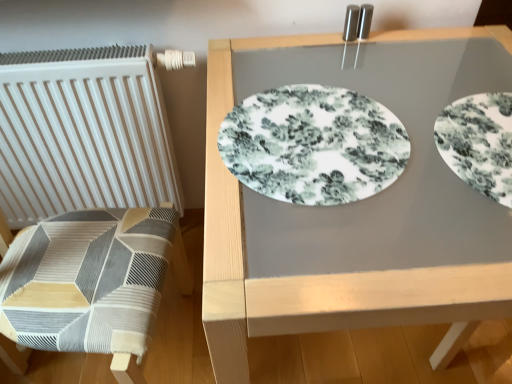
This screenshot has height=384, width=512. What do you see at coordinates (313, 145) in the screenshot?
I see `white floral plate at center, the 2th plate in the right-to-left sequence` at bounding box center [313, 145].

What do you see at coordinates (316, 251) in the screenshot? I see `white glossy placemat at center` at bounding box center [316, 251].

Find the location of a particular element. This screenshot has width=512, height=384. white floral plate at upper right, marked as the second plate in a left-to-right arrangement is located at coordinates 479,142.

This screenshot has width=512, height=384. Identify the location of white matte radiator at left. (83, 133).

What is the approximate height of white matte radiator at left?

white matte radiator at left is 22.07 inches tall.

Locate an element on the screen. This screenshot has width=512, height=384. white floral plate at center, the 1th plate in the left-to-right sequence is located at coordinates (313, 145).

Locate an element on the screen. The height and width of the screenshot is (384, 512). the 1st plate behind the white glossy placemat at center is located at coordinates (479, 142).

From a real-world perspective, which is physically below, white floral plate at upper right, marked as the second plate in a left-to-right arrangement, or white glossy placemat at center?

white glossy placemat at center is physically lower.

Does white floral plate at upper right, marked as the second plate in a left-to-right arrangement, have a smaller size compared to white glossy placemat at center?

Correct, white floral plate at upper right, marked as the second plate in a left-to-right arrangement, occupies less space than white glossy placemat at center.

Is white floral plate at upper right, placed as the first plate when sorted from right to left, beside white glossy placemat at center?

No, white floral plate at upper right, placed as the first plate when sorted from right to left, is not with white glossy placemat at center.

Considering the relative positions of white glossy placemat at center and white floral plate at center, the 2th plate in the right-to-left sequence, in the image provided, is white glossy placemat at center to the left of white floral plate at center, the 2th plate in the right-to-left sequence, from the viewer's perspective?

In fact, white glossy placemat at center is to the right of white floral plate at center, the 2th plate in the right-to-left sequence.

Considering the points (480, 80) and (268, 180), which point is behind, point (480, 80) or point (268, 180)?

The point (480, 80) is farther from the camera.

The image size is (512, 384). In order to click on the 2nd plate above the white glossy placemat at center (from the image's perspective) in this screenshot , I will do `click(313, 145)`.

Starting from the white matte radiator at left, which plate is the 2nd one in front? Please provide its 2D coordinates.

[(479, 142)]

Is white floral plate at upper right, placed as the first plate when sorted from right to left, further to camera compared to white matte radiator at left?

No, white floral plate at upper right, placed as the first plate when sorted from right to left, is closer to the viewer.

Is white floral plate at upper right, marked as the second plate in a left-to-right arrangement, looking in the opposite direction of white matte radiator at left?

No, white floral plate at upper right, marked as the second plate in a left-to-right arrangement, is not facing the opposite direction of white matte radiator at left.

From a real-world perspective, is white floral plate at upper right, marked as the second plate in a left-to-right arrangement, positioned above or below white matte radiator at left?

In terms of real-world spatial position, white floral plate at upper right, marked as the second plate in a left-to-right arrangement, is above white matte radiator at left.

From the image's perspective, is white floral plate at center, the 2th plate in the right-to-left sequence, located beneath white matte radiator at left?

Yes.

Is white floral plate at center, the 2th plate in the right-to-left sequence, looking in the opposite direction of white matte radiator at left?

No, white floral plate at center, the 2th plate in the right-to-left sequence, is not facing away from white matte radiator at left.

In terms of height, does white floral plate at center, the 1th plate in the left-to-right sequence, look taller or shorter compared to white matte radiator at left?

white floral plate at center, the 1th plate in the left-to-right sequence, is shorter than white matte radiator at left.

From a real-world perspective, is white glossy placemat at center physically below white matte radiator at left?

Yes.

Which is closer to the camera, (402, 207) or (129, 140)?

The point (402, 207) is closer to the camera.

Is white glossy placemat at center with white matte radiator at left?

white glossy placemat at center and white matte radiator at left are clearly separated.

From the image's perspective, is white matte radiator at left under white floral plate at upper right, placed as the first plate when sorted from right to left?

No.

Which object is wider, white matte radiator at left or white floral plate at upper right, marked as the second plate in a left-to-right arrangement?

white floral plate at upper right, marked as the second plate in a left-to-right arrangement, is wider.

Measure the distance from white matte radiator at left to white floral plate at upper right, marked as the second plate in a left-to-right arrangement.

The distance of white matte radiator at left from white floral plate at upper right, marked as the second plate in a left-to-right arrangement, is 36.12 inches.

Are white matte radiator at left and white floral plate at upper right, marked as the second plate in a left-to-right arrangement, beside each other?

No, white matte radiator at left is not in contact with white floral plate at upper right, marked as the second plate in a left-to-right arrangement.

Which is correct: white floral plate at center, the 2th plate in the right-to-left sequence, is inside white floral plate at upper right, placed as the first plate when sorted from right to left, or outside of it?

white floral plate at center, the 2th plate in the right-to-left sequence, is spatially situated outside white floral plate at upper right, placed as the first plate when sorted from right to left.

Considering the sizes of objects white floral plate at center, the 1th plate in the left-to-right sequence, and white floral plate at upper right, placed as the first plate when sorted from right to left, in the image provided, who is bigger, white floral plate at center, the 1th plate in the left-to-right sequence, or white floral plate at upper right, placed as the first plate when sorted from right to left,?

white floral plate at center, the 1th plate in the left-to-right sequence, is bigger.

Is white floral plate at center, the 1th plate in the left-to-right sequence, facing towards white floral plate at upper right, placed as the first plate when sorted from right to left?

No, white floral plate at center, the 1th plate in the left-to-right sequence, does not turn towards white floral plate at upper right, placed as the first plate when sorted from right to left.

From a real-world perspective, is white floral plate at center, the 2th plate in the right-to-left sequence, located higher than white floral plate at upper right, marked as the second plate in a left-to-right arrangement?

No, from a real-world perspective, white floral plate at center, the 2th plate in the right-to-left sequence, is not over white floral plate at upper right, marked as the second plate in a left-to-right arrangement

The image size is (512, 384). What are the coordinates of `table that is under the white floral plate at upper right, marked as the second plate in a left-to-right arrangement (from a real-world perspective)` in the screenshot? It's located at (316, 251).

From the white glossy placemat at center, count 2nd plates backward and point to it. Please provide its 2D coordinates.

[(313, 145)]

From the image, which object appears to be nearer to white floral plate at upper right, placed as the first plate when sorted from right to left, white glossy placemat at center or white floral plate at center, the 1th plate in the left-to-right sequence?

Among the two, white floral plate at center, the 1th plate in the left-to-right sequence, is located nearer to white floral plate at upper right, placed as the first plate when sorted from right to left.

Which object lies further to the anchor point white floral plate at upper right, placed as the first plate when sorted from right to left, white floral plate at center, the 1th plate in the left-to-right sequence, or white matte radiator at left?

white matte radiator at left.

Considering their positions, is white glossy placemat at center positioned closer to white floral plate at center, the 2th plate in the right-to-left sequence, than white matte radiator at left?

white glossy placemat at center lies closer to white floral plate at center, the 2th plate in the right-to-left sequence, than the other object.

From the image, which object appears to be nearer to white glossy placemat at center, white floral plate at center, the 2th plate in the right-to-left sequence, or white floral plate at upper right, placed as the first plate when sorted from right to left?

white floral plate at center, the 2th plate in the right-to-left sequence.

Considering their positions, is white floral plate at upper right, placed as the first plate when sorted from right to left, positioned closer to white glossy placemat at center than white matte radiator at left?

The object closer to white glossy placemat at center is white floral plate at upper right, placed as the first plate when sorted from right to left.

When comparing their distances from white matte radiator at left, does white glossy placemat at center or white floral plate at center, the 1th plate in the left-to-right sequence, seem further?

The object further to white matte radiator at left is white floral plate at center, the 1th plate in the left-to-right sequence.

Based on their spatial positions, is white floral plate at upper right, placed as the first plate when sorted from right to left, or white matte radiator at left further from white floral plate at center, the 1th plate in the left-to-right sequence?

white matte radiator at left is further to white floral plate at center, the 1th plate in the left-to-right sequence.

Estimate the real-world distances between objects in this image. Which object is further from white floral plate at upper right, placed as the first plate when sorted from right to left, white matte radiator at left or white floral plate at center, the 2th plate in the right-to-left sequence?

Among the two, white matte radiator at left is located further to white floral plate at upper right, placed as the first plate when sorted from right to left.

This screenshot has height=384, width=512. In order to click on plate between white matte radiator at left and white glossy placemat at center in this screenshot , I will do `click(313, 145)`.

Image resolution: width=512 pixels, height=384 pixels. I want to click on table located between white matte radiator at left and white floral plate at upper right, marked as the second plate in a left-to-right arrangement, in the left-right direction, so click(x=316, y=251).

The height and width of the screenshot is (384, 512). Identify the location of plate located between white matte radiator at left and white floral plate at upper right, marked as the second plate in a left-to-right arrangement, in the left-right direction. (313, 145).

This screenshot has height=384, width=512. Find the location of `table located between white floral plate at center, the 1th plate in the left-to-right sequence, and white floral plate at upper right, marked as the second plate in a left-to-right arrangement, in the left-right direction`. table located between white floral plate at center, the 1th plate in the left-to-right sequence, and white floral plate at upper right, marked as the second plate in a left-to-right arrangement, in the left-right direction is located at coordinates (316, 251).